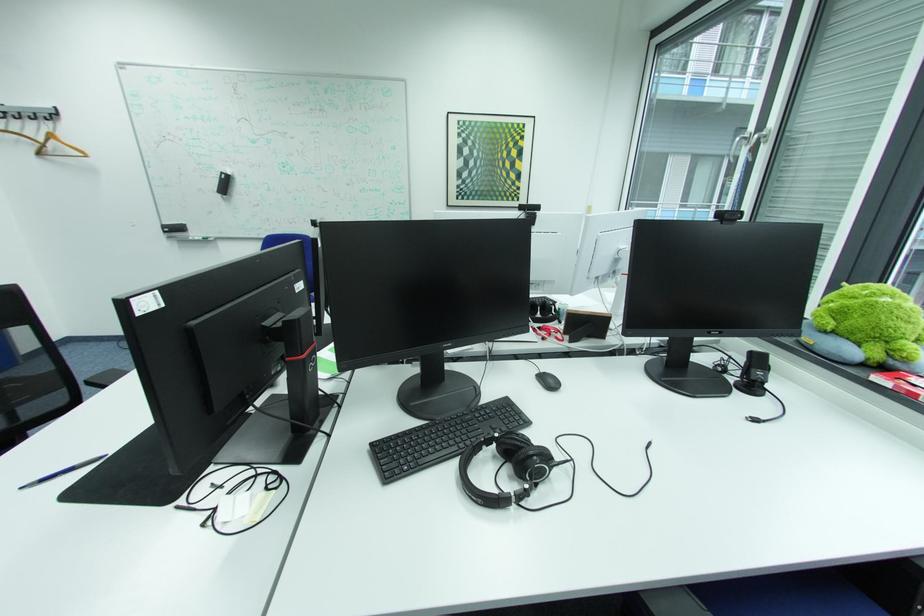
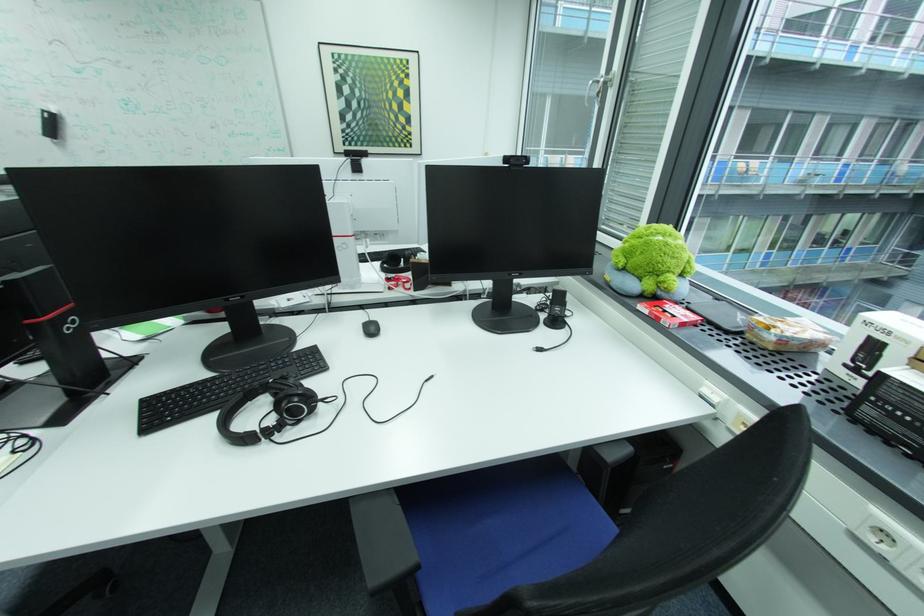
Locate, in the second image, the point that corresponds to the point at 456,206 in the first image.

(344, 153)